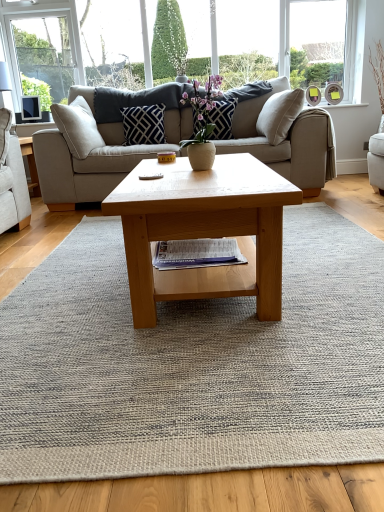
Question: Considering the positions of point (258, 231) and point (69, 182), is point (258, 231) closer or farther from the camera than point (69, 182)?

Choices:
 (A) closer
 (B) farther

Answer: (A)

Question: In terms of width, does light brown wooden coffee table at center look wider or thinner when compared to beige fabric couch at center?

Choices:
 (A) thin
 (B) wide

Answer: (A)

Question: Which object is the closest to the navy blue textured pillow at upper center, which ranks as the second pillow in right-to-left order?

Choices:
 (A) matte black pillow at center, which ranks as the 1th pillow in right-to-left order
 (B) white textured bay window at upper right
 (C) light brown wooden coffee table at center
 (D) beige fabric couch at center
 (E) neutral woven rug at center

Answer: (D)

Question: Based on their relative distances, which object is farther from the neutral woven rug at center?

Choices:
 (A) navy blue textured pillow at upper center, positioned as the 1th pillow in left-to-right order
 (B) beige fabric couch at center
 (C) white textured bay window at upper right
 (D) light brown wooden coffee table at center
 (E) matte black pillow at center, which ranks as the 1th pillow in right-to-left order

Answer: (C)